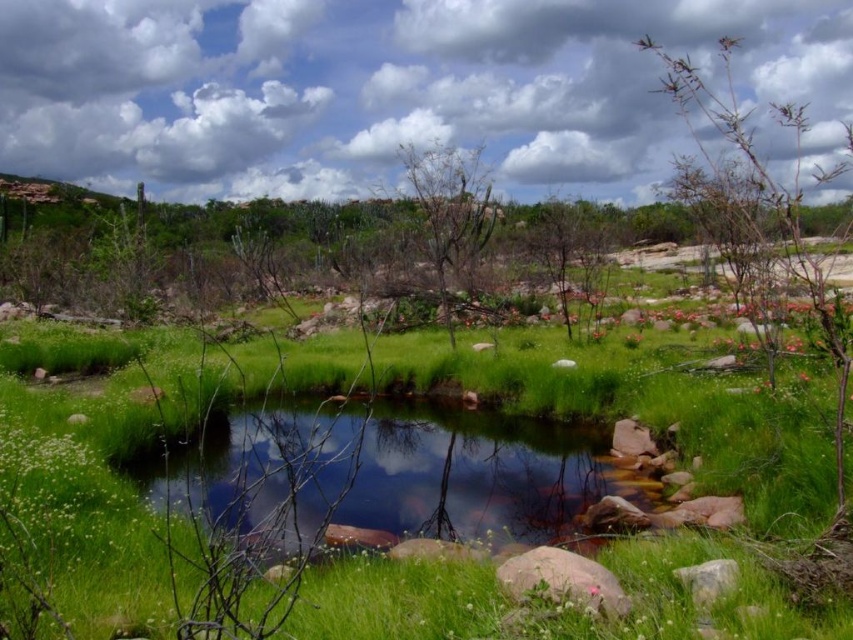
Question: Is clear water at center bigger than gray rough rock at lower right?

Choices:
 (A) no
 (B) yes

Answer: (B)

Question: Does green grass at center appear over bare branches at center?

Choices:
 (A) yes
 (B) no

Answer: (B)

Question: Where is green grass at center located in relation to smooth pink rock at lower center in the image?

Choices:
 (A) right
 (B) left

Answer: (B)

Question: Which point is farther from the camera taking this photo?

Choices:
 (A) (563, 248)
 (B) (706, 90)
 (C) (457, 428)

Answer: (B)

Question: Which point appears farthest from the camera in this image?

Choices:
 (A) (666, 88)
 (B) (576, 572)

Answer: (A)

Question: Based on their relative distances, which object is nearer to the gray rough rock at lower right?

Choices:
 (A) bare branches at upper right
 (B) green grass at center

Answer: (B)